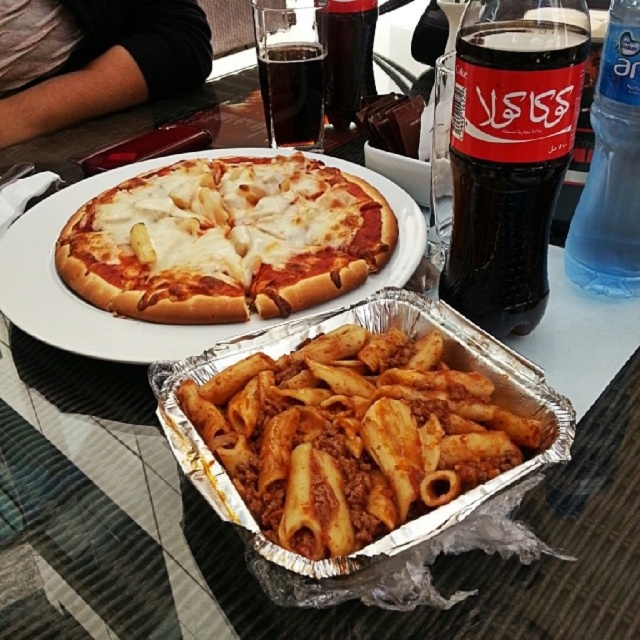
You are a food delivery person and need to place a hot beverage between the pizza and the matte yellow pasta at center so that it is equidistant from both. Is this possible given their current positions?

Yes, since the pizza and the matte yellow pasta at center are 8.22 inches apart, placing the beverage exactly halfway between them would ensure it is equidistant from both.

You are a waiter trying to place a new menu on the table. The menu is 12 inches wide. There is space between the gray fabric shirt at upper left and the dark glass soda at upper center. Can the menu fit in that space?

The gray fabric shirt at upper left might be wider than dark glass soda at upper center, so the space between them may not be wide enough to fit a 12 inch menu. Check the exact width before placing it.